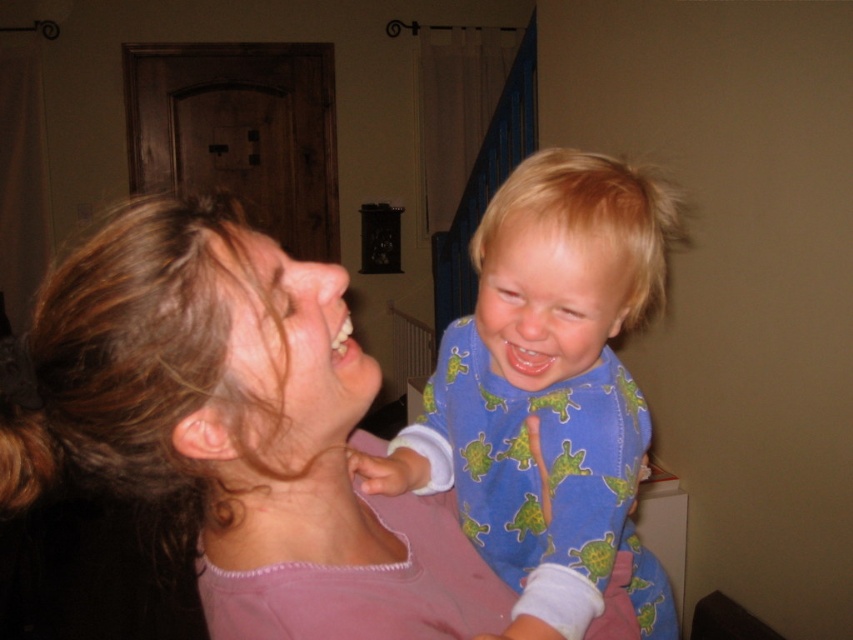
You are a fashion designer observing this scene. You need to decide which clothing item, the pink fabric shirt at upper left or the blue soft pajamas at center, would require more fabric to produce a similar style. Which one would it be?

The pink fabric shirt at upper left is larger in size than the blue soft pajamas at center, so it would require more fabric to produce a similar style.

You are a photographer trying to capture a candid shot of the two people in the image. You want to focus on the pink fabric shirt at upper left and the blue soft pajamas at center. Which clothing item is positioned higher in the frame?

The pink fabric shirt at upper left is positioned higher in the frame than the blue soft pajamas at center.

You are an interior designer analyzing the spatial layout of this home scene. You need to determine the exact location of the pink fabric shirt at upper left. Where is it located in terms of coordinates?

The pink fabric shirt at upper left is located at coordinates point (236,429).